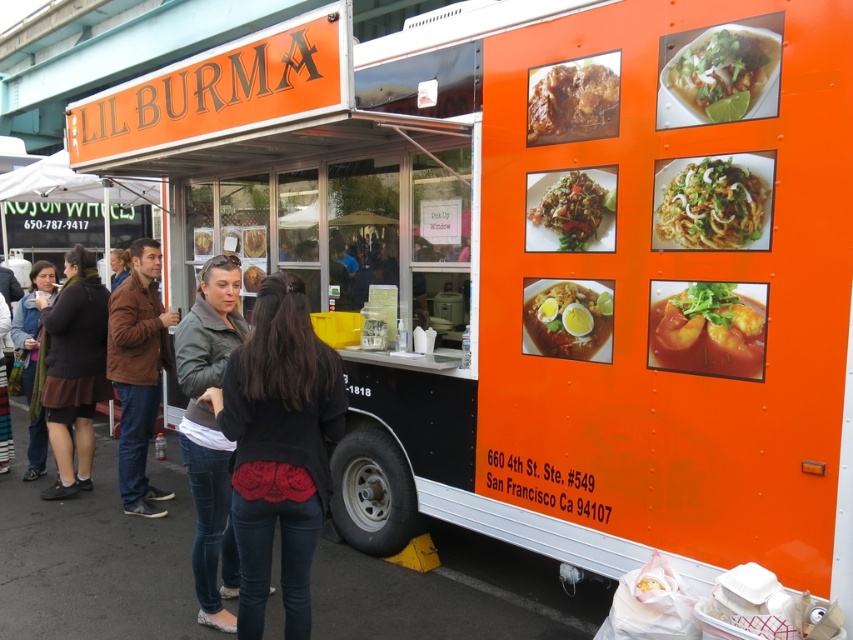
You are standing in front of the Lil Burma food truck and notice a dark brown sweater at left. Where exactly is the dark brown sweater located on the truck?

The dark brown sweater at left is located at point [74,369] on the Lil Burma food truck.

You are a customer at the Lil Burma food truck and you want to order the dish that has the brown glossy meat at upper center. The menu shows a photo of the dish with the leather jacket at center. Which object is bigger in the photo?

The leather jacket at center is larger in size than the brown glossy meat at upper center in the photo.